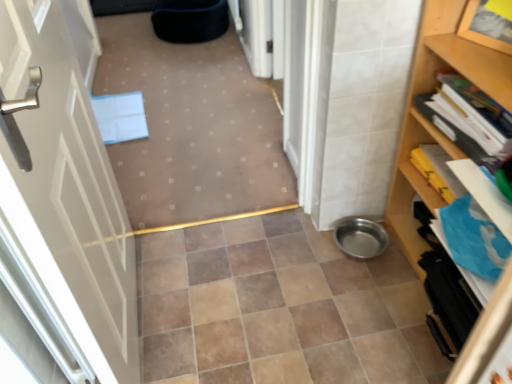
Question: Based on their positions, is matte blue folder at center located to the left or right of white glossy door at left?

Choices:
 (A) left
 (B) right

Answer: (B)

Question: Is matte blue folder at center spatially inside white glossy door at left, or outside of it?

Choices:
 (A) inside
 (B) outside

Answer: (B)

Question: Considering the real-world distances, which object is closest to the brown ceramic tile at center?

Choices:
 (A) white glossy door at left
 (B) wooden bookshelf at right
 (C) matte blue folder at center

Answer: (A)

Question: Considering the real-world distances, which object is closest to the white glossy door at left?

Choices:
 (A) matte blue folder at center
 (B) brown ceramic tile at center
 (C) wooden bookshelf at right

Answer: (B)